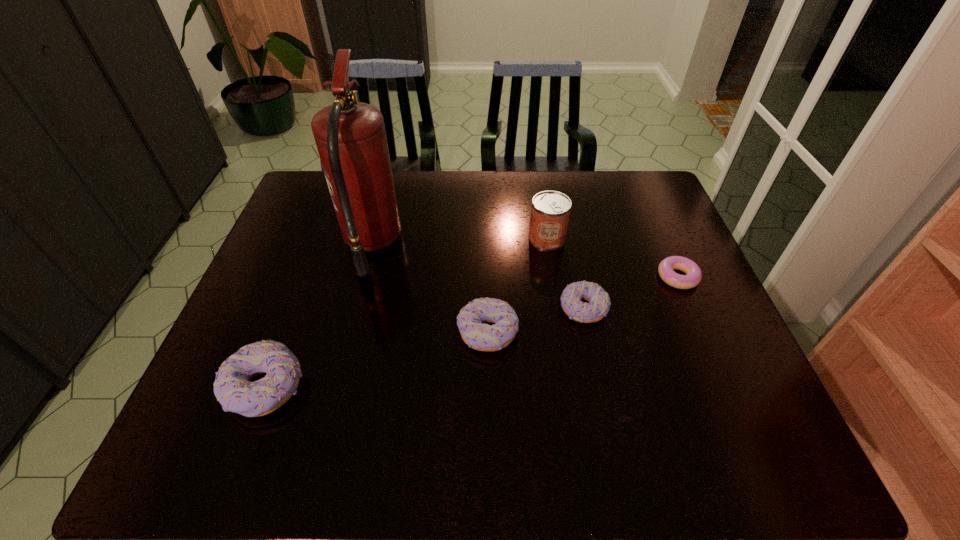
To achieve even spacing by inserting another doughnut among them, please point to a vacant spot for this new doughnut. Please provide its 2D coordinates. Your answer should be formatted as a tuple, i.e. [(x, y)], where the tuple contains the x and y coordinates of a point satisfying the conditions above.

[(382, 359)]